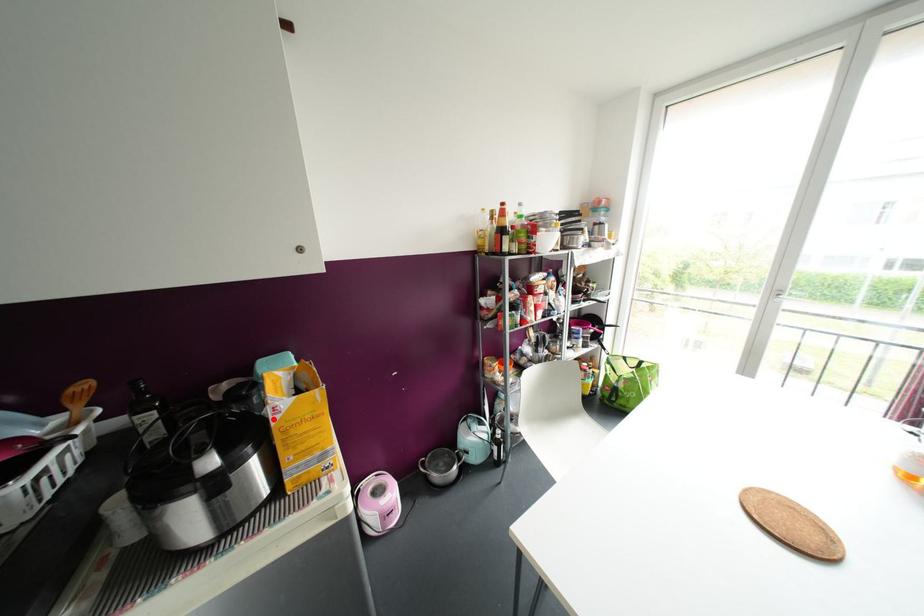
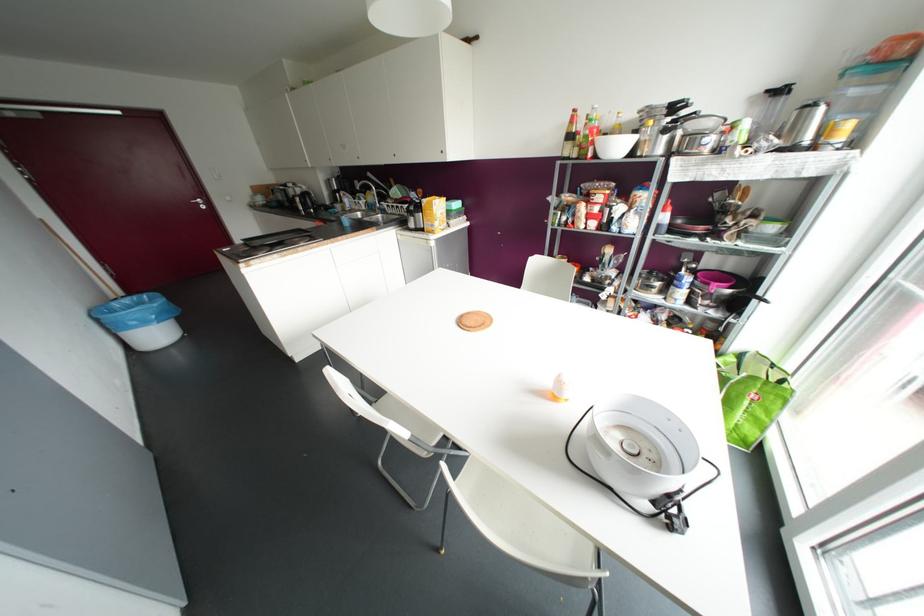
In the second image, find the point that corresponds to the highlighted location in the first image.

(421, 204)